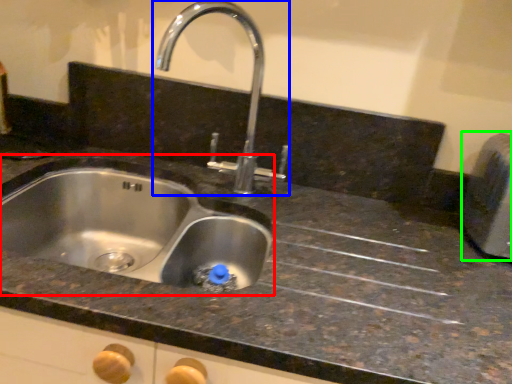
Question: Based on their relative distances, which object is farther from sink (highlighted by a red box)? Choose from tap (highlighted by a blue box) and appliance (highlighted by a green box).

Choices:
 (A) tap
 (B) appliance

Answer: (B)